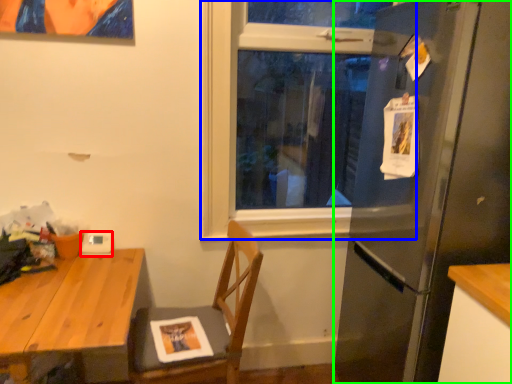
Question: Based on their relative distances, which object is nearer to appliance (highlighted by a red box)? Choose from window (highlighted by a blue box) and refrigerator (highlighted by a green box).

Choices:
 (A) window
 (B) refrigerator

Answer: (A)